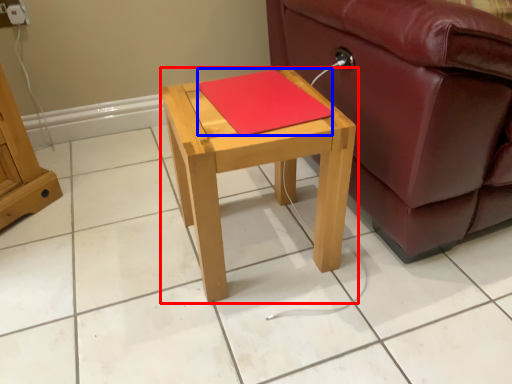
Question: Which object is closer to the camera taking this photo, table (highlighted by a red box) or pad (highlighted by a blue box)?

Choices:
 (A) table
 (B) pad

Answer: (A)